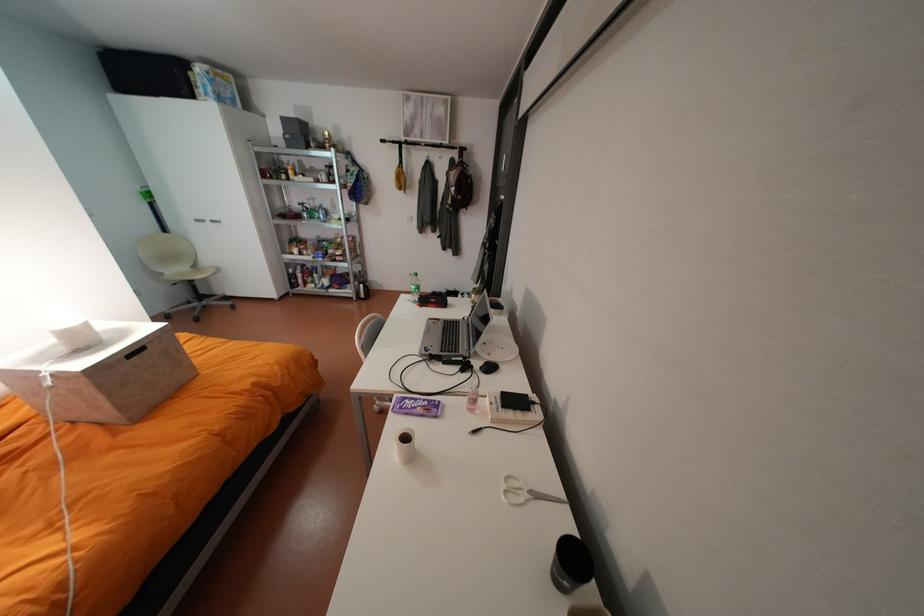
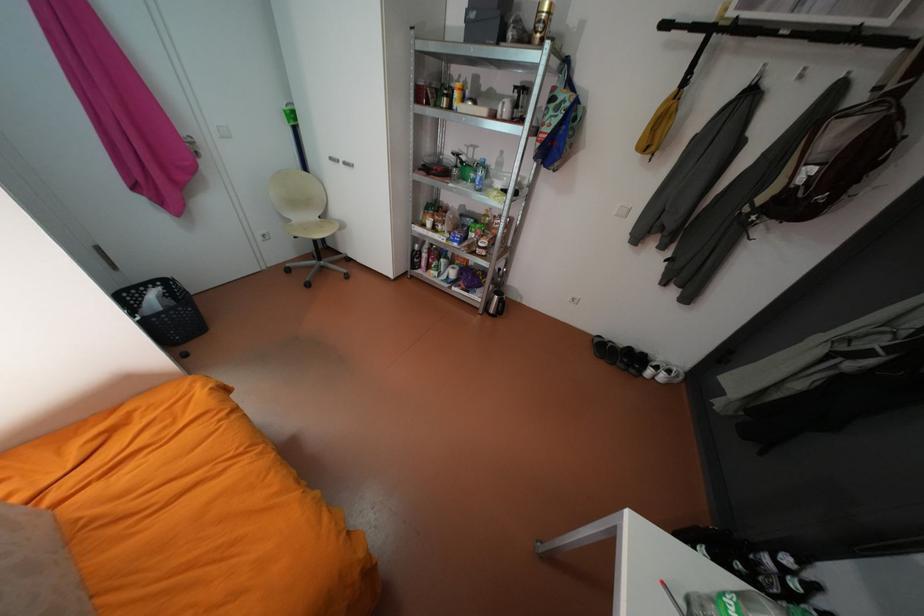
Locate, in the second image, the point that corresponds to [302,284] in the first image.

(423, 265)